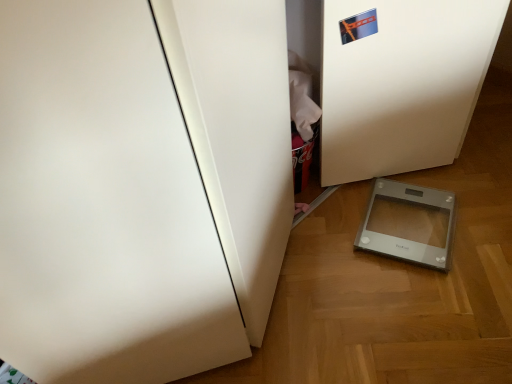
Identify the location of vacant space underneath transparent plastic scale at lower right (from a real-world perspective). (407, 215).